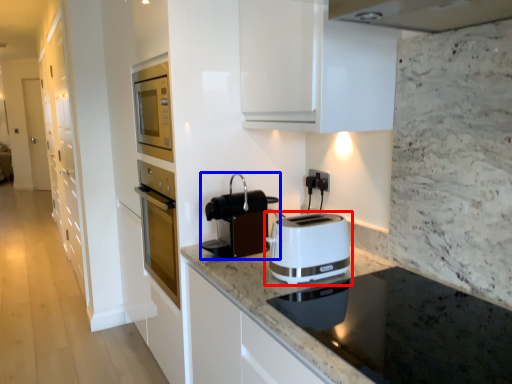
Question: Among these objects, which one is nearest to the camera, toaster (highlighted by a red box) or kitchen appliance (highlighted by a blue box)?

Choices:
 (A) toaster
 (B) kitchen appliance

Answer: (A)